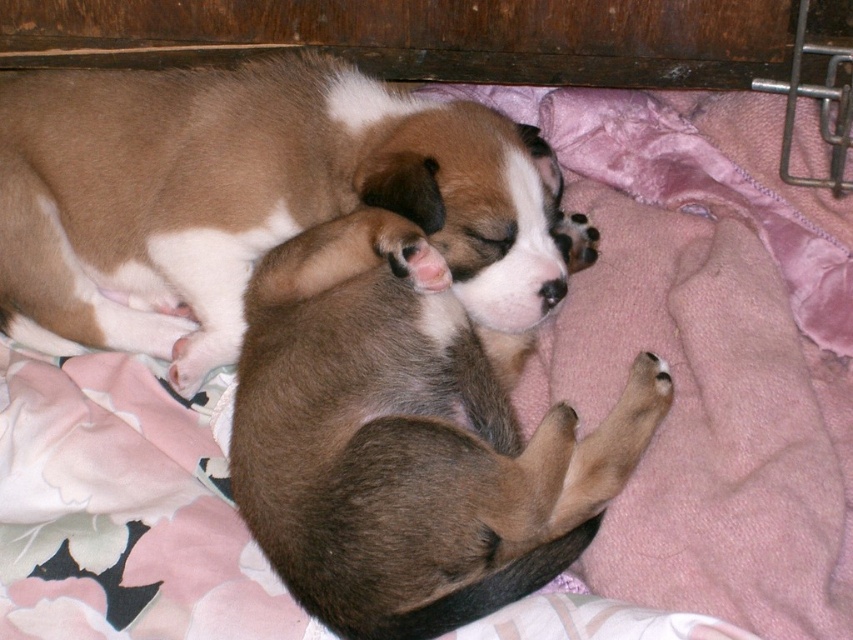
This screenshot has width=853, height=640. What do you see at coordinates (245, 198) in the screenshot? I see `brown fur dog at center` at bounding box center [245, 198].

Is brown fur dog at center above brown furry dog at center?

Indeed, brown fur dog at center is positioned over brown furry dog at center.

Who is more forward, (93,161) or (363,577)?

Positioned in front is point (363,577).

Find the location of a particular element. This screenshot has width=853, height=640. brown fur dog at center is located at coordinates (245, 198).